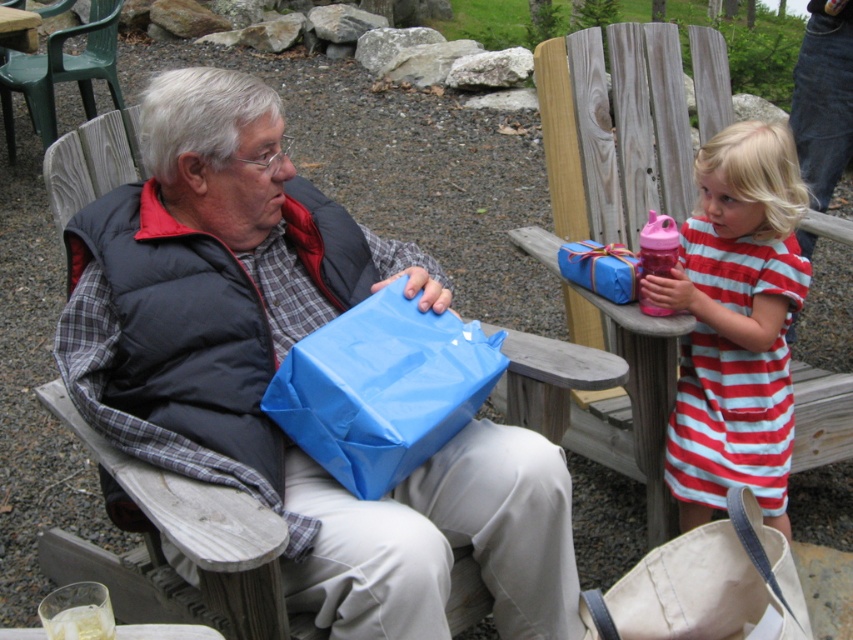
Question: Considering the relative positions of blue matte gift bag at center and blue matte gift at upper center in the image provided, where is blue matte gift bag at center located with respect to blue matte gift at upper center?

Choices:
 (A) left
 (B) right

Answer: (A)

Question: Which point is closer to the camera?

Choices:
 (A) (636, 273)
 (B) (741, 545)
 (C) (653, 328)
 (D) (376, 433)

Answer: (B)

Question: Does blue matte gift bag at center appear under wooden chair at upper center?

Choices:
 (A) no
 (B) yes

Answer: (B)

Question: Which object is farther from the camera taking this photo?

Choices:
 (A) blue matte gift bag at center
 (B) canvas tote bag at lower right
 (C) blue glossy bag at center
 (D) blue matte gift at upper center

Answer: (D)

Question: Which point is closer to the camera?

Choices:
 (A) (376, 465)
 (B) (4, 88)
 (C) (570, 256)

Answer: (A)

Question: In this image, where is blue matte gift bag at center located relative to blue glossy bag at center?

Choices:
 (A) above
 (B) below

Answer: (B)